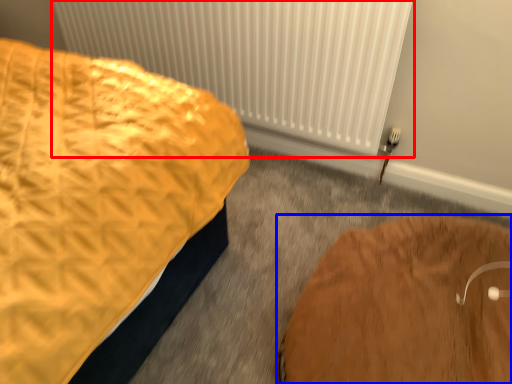
Question: Which of the following is the farthest to the observer, radiator (highlighted by a red box) or furniture (highlighted by a blue box)?

Choices:
 (A) radiator
 (B) furniture

Answer: (A)